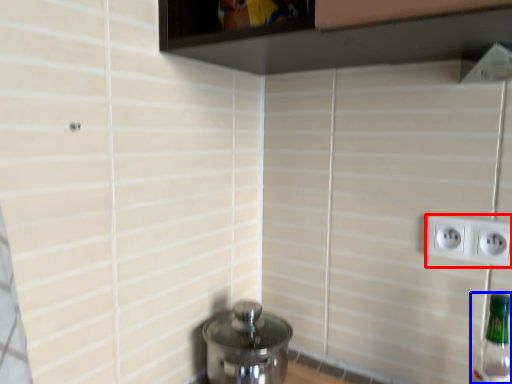
Question: Which of the following is the farthest to the observer, power plugs and sockets (highlighted by a red box) or bottle (highlighted by a blue box)?

Choices:
 (A) power plugs and sockets
 (B) bottle

Answer: (A)